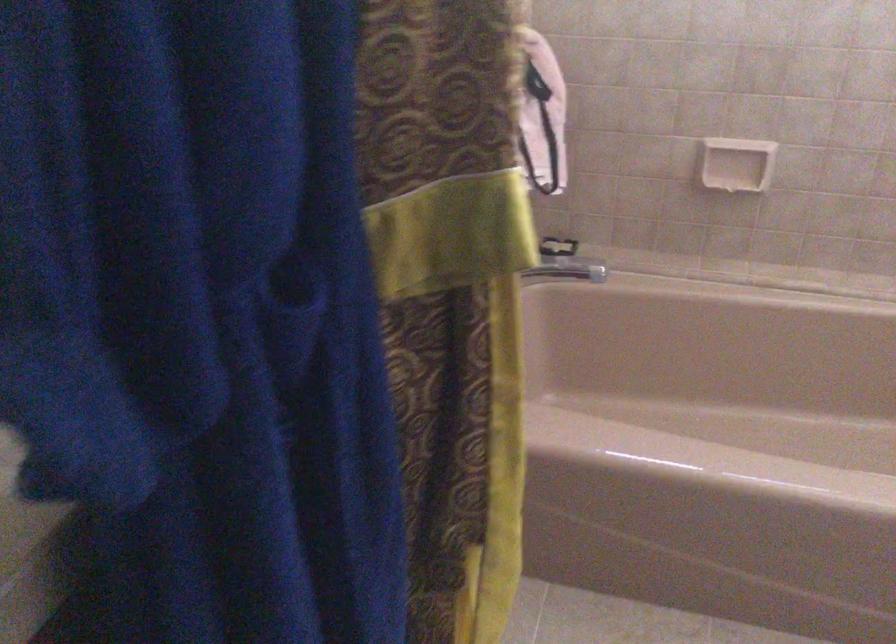
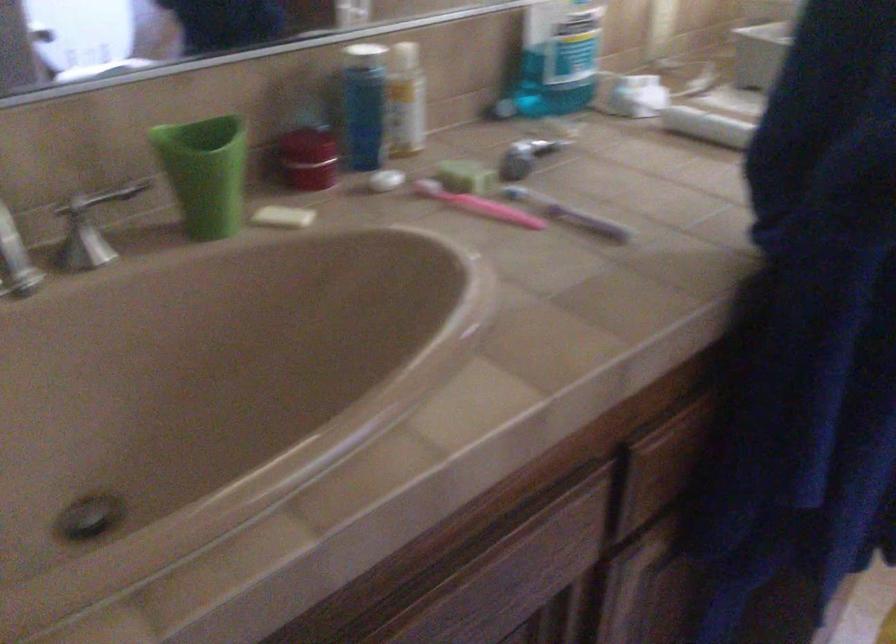
Question: The camera is either moving clockwise (left) or counter-clockwise (right) around the object. The first image is from the beginning of the video and the second image is from the end. Is the camera moving left or right when shooting the video?

Choices:
 (A) Left
 (B) Right

Answer: (B)